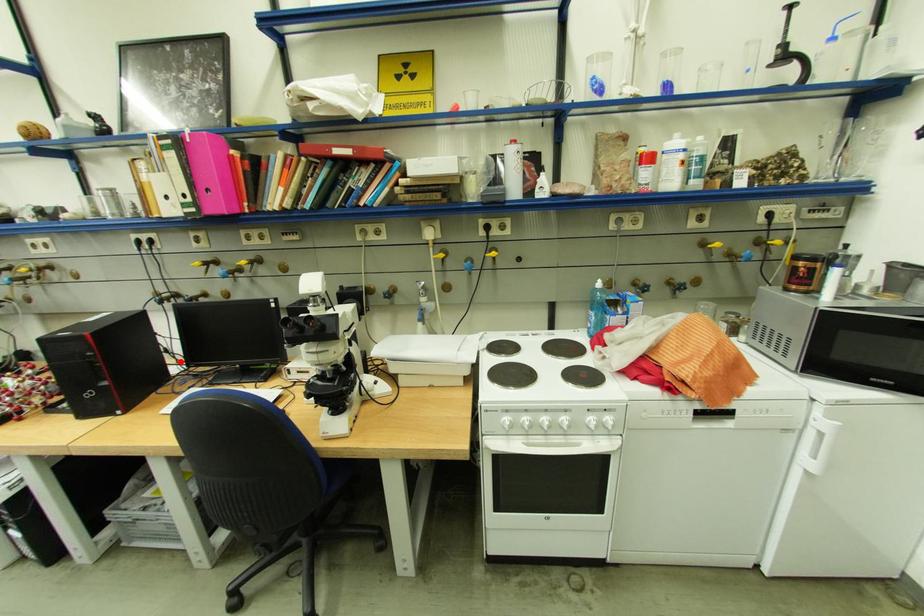
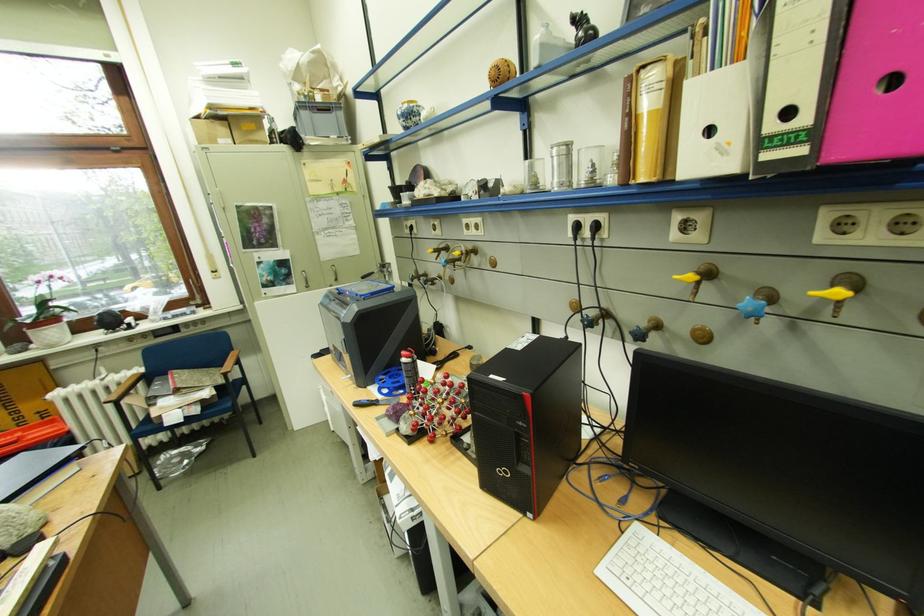
Locate, in the second image, the point that corresponds to the highlighted location in the first image.

(593, 421)